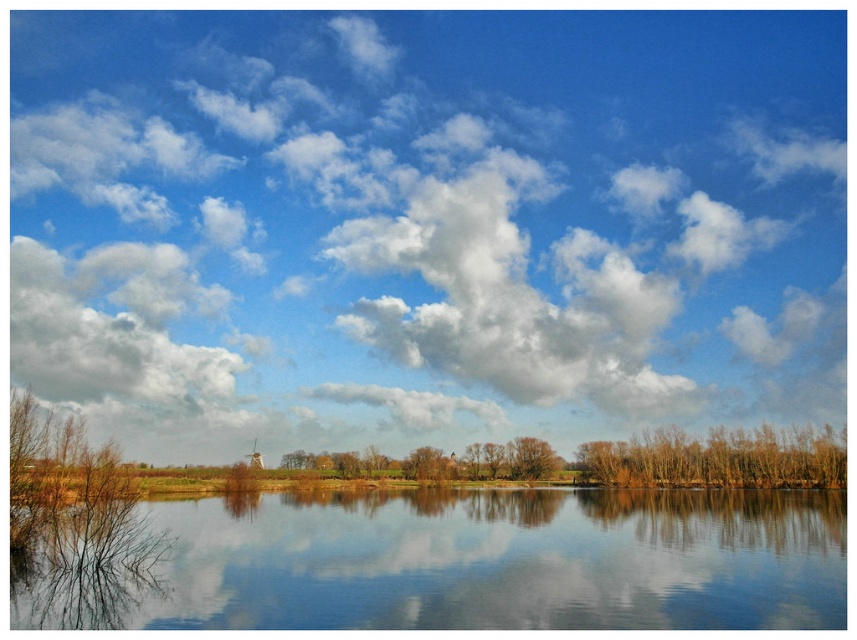
Question: Which of the following is the farthest from the observer?

Choices:
 (A) (28, 593)
 (B) (595, 476)
 (C) (232, 422)

Answer: (C)

Question: Does white fluffy cloud at upper left have a smaller size compared to brown matte tree at center?

Choices:
 (A) no
 (B) yes

Answer: (A)

Question: Does transparent glass water at center appear under brown matte tree at lower left?

Choices:
 (A) yes
 (B) no

Answer: (A)

Question: Can you confirm if white fluffy cloud at upper center is thinner than white fluffy cloud at upper left?

Choices:
 (A) no
 (B) yes

Answer: (A)

Question: Which of the following is the farthest from the observer?

Choices:
 (A) (118, 372)
 (B) (51, 572)
 (C) (536, 456)

Answer: (A)

Question: Which is nearer to the brown matte tree at center?

Choices:
 (A) white fluffy cloud at upper left
 (B) white fluffy cloud at upper center
 (C) brown matte tree at lower left

Answer: (B)